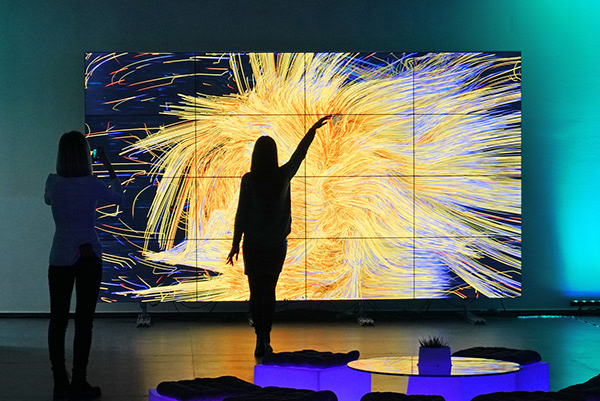
You are a GUI agent. You are given a task and a screenshot of the screen. Output one action in this format:
    pyautogui.click(x=<x>, y=<y>)
    Task: Click on the led screen
    Image resolution: width=600 pixels, height=401 pixels.
    Given the screenshot: What is the action you would take?
    pyautogui.click(x=355, y=151)